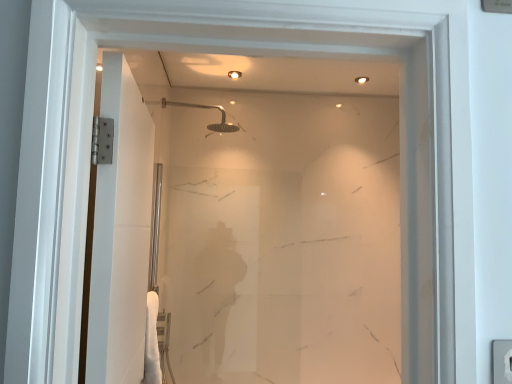
This screenshot has height=384, width=512. What do you see at coordinates (207, 108) in the screenshot? I see `matte silver shower head at upper center` at bounding box center [207, 108].

The height and width of the screenshot is (384, 512). Find the location of `matte silver shower head at upper center`. matte silver shower head at upper center is located at coordinates (207, 108).

This screenshot has height=384, width=512. What do you see at coordinates (121, 233) in the screenshot?
I see `clear glass screen door at left` at bounding box center [121, 233].

Find the location of a particular element. The width and height of the screenshot is (512, 384). clear glass screen door at left is located at coordinates (121, 233).

Find the location of a particular element. This screenshot has height=384, width=512. matte silver shower head at upper center is located at coordinates (207, 108).

In the image, is clear glass screen door at left on the left side or the right side of matte silver shower head at upper center?

From the image, it's evident that clear glass screen door at left is to the left of matte silver shower head at upper center.

Based on the photo, does clear glass screen door at left come in front of matte silver shower head at upper center?

Yes, the depth of clear glass screen door at left is less than that of matte silver shower head at upper center.

Does point (147, 124) come farther from viewer compared to point (225, 119)?

No, it is not.

From the image's perspective, is clear glass screen door at left on top of matte silver shower head at upper center?

No, from the image's perspective, clear glass screen door at left is not over matte silver shower head at upper center.

From a real-world perspective, relative to matte silver shower head at upper center, is clear glass screen door at left vertically above or below?

clear glass screen door at left is below matte silver shower head at upper center.

Is clear glass screen door at left thinner than matte silver shower head at upper center?

Correct, the width of clear glass screen door at left is less than that of matte silver shower head at upper center.

Considering the relative sizes of clear glass screen door at left and matte silver shower head at upper center in the image provided, is clear glass screen door at left shorter than matte silver shower head at upper center?

No.

Does clear glass screen door at left have a larger size compared to matte silver shower head at upper center?

Correct, clear glass screen door at left is larger in size than matte silver shower head at upper center.

In the scene shown: Is clear glass screen door at left spatially inside matte silver shower head at upper center, or outside of it?

clear glass screen door at left is not enclosed by matte silver shower head at upper center.

Would you say clear glass screen door at left is a long distance from matte silver shower head at upper center?

Absolutely, clear glass screen door at left is distant from matte silver shower head at upper center.

Is clear glass screen door at left looking in the opposite direction of matte silver shower head at upper center?

No, clear glass screen door at left is not facing the opposite direction of matte silver shower head at upper center.

How different are the orientations of clear glass screen door at left and matte silver shower head at upper center in degrees?

There is a 1.65-degree angle between the facing directions of clear glass screen door at left and matte silver shower head at upper center.

How far apart are clear glass screen door at left and matte silver shower head at upper center?

They are 1.62 meters apart.

This screenshot has height=384, width=512. In order to click on shower that is above the clear glass screen door at left (from a real-world perspective) in this screenshot , I will do `click(207, 108)`.

Considering the relative positions of matte silver shower head at upper center and clear glass screen door at left in the image provided, is matte silver shower head at upper center to the left of clear glass screen door at left from the viewer's perspective?

Incorrect, matte silver shower head at upper center is not on the left side of clear glass screen door at left.

Considering their positions, is matte silver shower head at upper center located in front of or behind clear glass screen door at left?

matte silver shower head at upper center is behind clear glass screen door at left.

Does point (209, 107) appear closer or farther from the camera than point (108, 215)?

Clearly, point (209, 107) is more distant from the camera than point (108, 215).

From the image's perspective, between matte silver shower head at upper center and clear glass screen door at left, who is located below?

clear glass screen door at left appears lower in the image.

From a real-world perspective, relative to clear glass screen door at left, is matte silver shower head at upper center vertically above or below?

From a real-world perspective, matte silver shower head at upper center is physically above clear glass screen door at left.

Can you confirm if matte silver shower head at upper center is wider than clear glass screen door at left?

Indeed, matte silver shower head at upper center has a greater width compared to clear glass screen door at left.

Considering the sizes of objects matte silver shower head at upper center and clear glass screen door at left in the image provided, who is shorter, matte silver shower head at upper center or clear glass screen door at left?

matte silver shower head at upper center is shorter.

Between matte silver shower head at upper center and clear glass screen door at left, which one has larger size?

clear glass screen door at left.

Consider the image. Does matte silver shower head at upper center contain clear glass screen door at left?

That's incorrect, clear glass screen door at left is not inside matte silver shower head at upper center.

From the picture: Is there a large distance between matte silver shower head at upper center and clear glass screen door at left?

matte silver shower head at upper center is far away from clear glass screen door at left.

Is matte silver shower head at upper center aimed at clear glass screen door at left?

No, matte silver shower head at upper center is not oriented towards clear glass screen door at left.

Measure the distance between matte silver shower head at upper center and clear glass screen door at left.

A distance of 5.32 feet exists between matte silver shower head at upper center and clear glass screen door at left.

What are the coordinates of `shower that is on the right side of clear glass screen door at left` in the screenshot? It's located at (207, 108).

Identify the location of screen door on the left of the matte silver shower head at upper center. The width and height of the screenshot is (512, 384). (121, 233).

Identify the location of screen door beneath the matte silver shower head at upper center (from a real-world perspective). (121, 233).